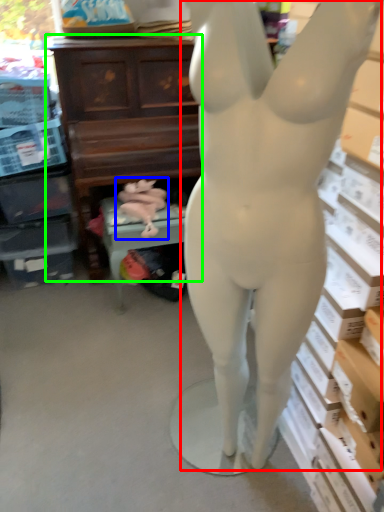
Question: Based on their relative distances, which object is nearer to person (highlighted by a red box)? Choose from animal sculpture (highlighted by a blue box) and entertainment center (highlighted by a green box).

Choices:
 (A) animal sculpture
 (B) entertainment center

Answer: (A)